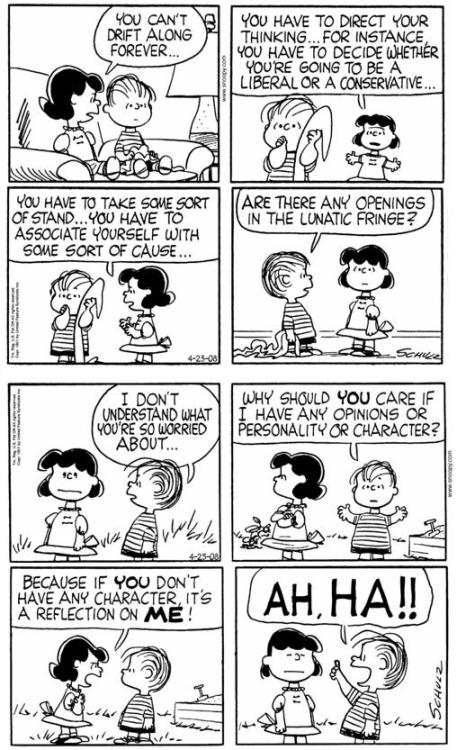
Locate an element on the screen. linus’s blanket is located at coordinates (144, 153), (322, 120), (279, 346), (98, 288).